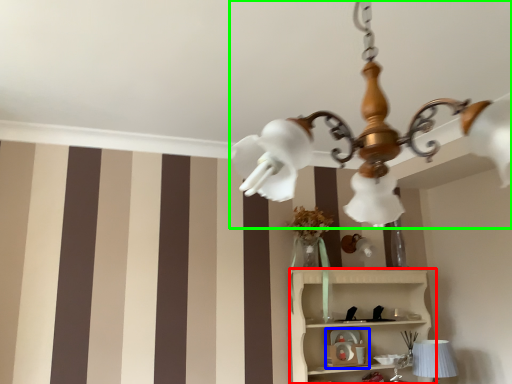
Question: Which object is positioned closest to shelf (highlighted by a red box)? Select from toy (highlighted by a blue box) and lamp (highlighted by a green box).

Choices:
 (A) toy
 (B) lamp

Answer: (A)